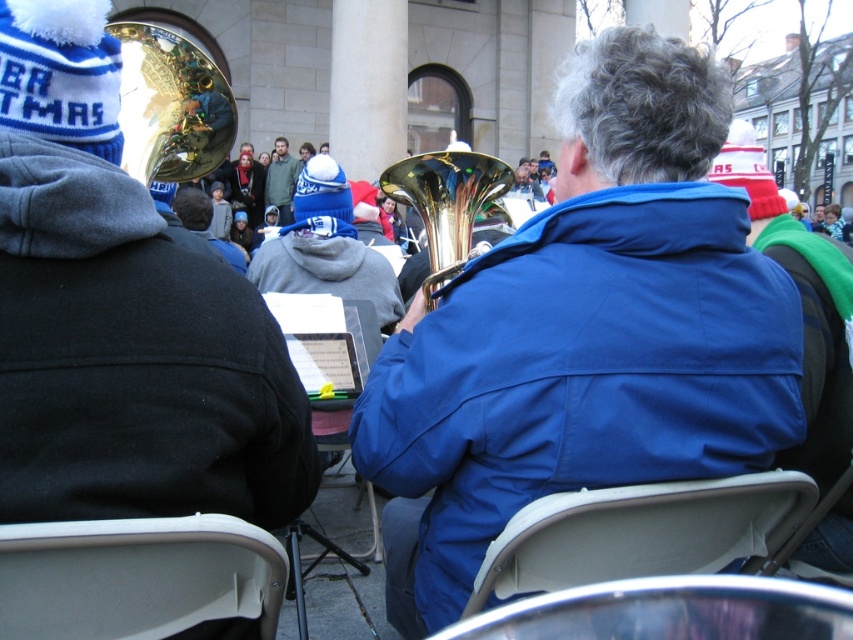
Is white plastic chair at center bigger than metallic silver chair at lower center?

Yes, white plastic chair at center is bigger than metallic silver chair at lower center.

Which is below, white plastic chair at center or metallic silver chair at lower center?

white plastic chair at center

Between point (753, 557) and point (540, 605), which one is positioned behind?

Point (753, 557)

Locate an element on the screen. Image resolution: width=853 pixels, height=640 pixels. white plastic chair at center is located at coordinates (642, 532).

Does shiny gold tuba at center have a greater width compared to gold reflective trumpet at upper left?

Correct, the width of shiny gold tuba at center exceeds that of gold reflective trumpet at upper left.

Who is more forward, (190, 413) or (190, 81)?

Point (190, 413)

Identify the location of shiny gold tuba at center. This screenshot has height=640, width=853. (120, 316).

Between shiny gold tuba at center and metallic silver chair at lower center, which one appears on the left side from the viewer's perspective?

From the viewer's perspective, shiny gold tuba at center appears more on the left side.

Is shiny gold tuba at center closer to camera compared to metallic silver chair at lower center?

No, shiny gold tuba at center is further to the viewer.

Where is `shiny gold tuba at center`? Image resolution: width=853 pixels, height=640 pixels. shiny gold tuba at center is located at coordinates (120, 316).

In order to click on shiny gold tuba at center in this screenshot , I will do `click(120, 316)`.